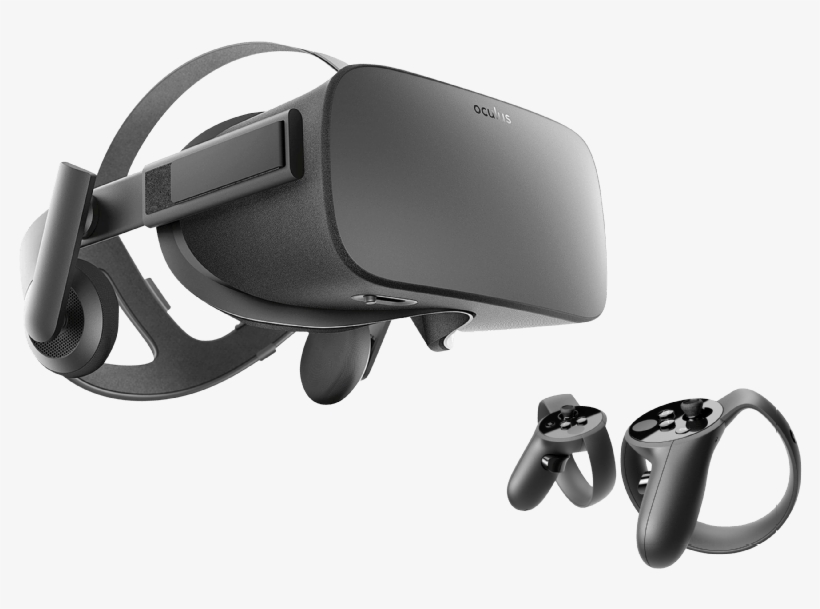
Find the location of a particular element. This screenshot has width=820, height=609. handle is located at coordinates (659, 516), (535, 479).